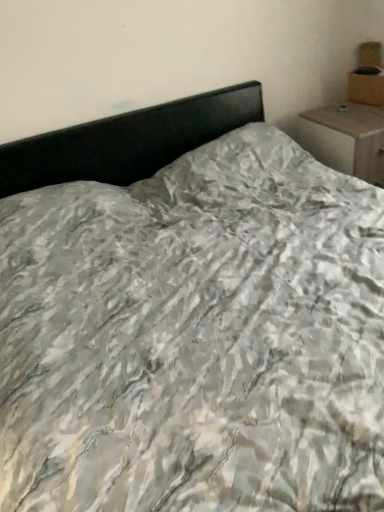
From the picture: Measure the distance between wooden nightstand at upper right and camera.

wooden nightstand at upper right is 6.69 feet away from camera.

You are a GUI agent. You are given a task and a screenshot of the screen. Output one action in this format:
    pyautogui.click(x=<x>, y=<y>)
    Task: Click on the wooden nightstand at upper right
    
    Given the screenshot: What is the action you would take?
    pyautogui.click(x=348, y=138)

The height and width of the screenshot is (512, 384). What do you see at coordinates (348, 138) in the screenshot? I see `wooden nightstand at upper right` at bounding box center [348, 138].

What is the approximate width of cardboard box at upper right?

It is 8.21 inches.

Identify the location of cardboard box at upper right. (366, 86).

Describe the element at coordinates (366, 86) in the screenshot. I see `cardboard box at upper right` at that location.

Where is `wooden nightstand at upper right`? Image resolution: width=384 pixels, height=512 pixels. wooden nightstand at upper right is located at coordinates (348, 138).

Considering the relative positions of cardboard box at upper right and wooden nightstand at upper right in the image provided, is cardboard box at upper right to the left or to the right of wooden nightstand at upper right?

Based on their positions, cardboard box at upper right is located to the right of wooden nightstand at upper right.

Between cardboard box at upper right and wooden nightstand at upper right, which one is positioned in front?

wooden nightstand at upper right is in front.

Is point (370, 70) farther from viewer compared to point (376, 176)?

Yes, point (370, 70) is behind point (376, 176).

From the image's perspective, relative to wooden nightstand at upper right, is cardboard box at upper right above or below?

From the image's perspective, cardboard box at upper right appears above wooden nightstand at upper right.

From a real-world perspective, is cardboard box at upper right positioned above or below wooden nightstand at upper right?

Clearly, from a real-world perspective, cardboard box at upper right is above wooden nightstand at upper right.

Which object is wider, cardboard box at upper right or wooden nightstand at upper right?

wooden nightstand at upper right.

Who is taller, cardboard box at upper right or wooden nightstand at upper right?

wooden nightstand at upper right is taller.

Does cardboard box at upper right have a larger size compared to wooden nightstand at upper right?

Incorrect, cardboard box at upper right is not larger than wooden nightstand at upper right.

Would you say cardboard box at upper right is outside wooden nightstand at upper right?

That's correct, cardboard box at upper right is outside of wooden nightstand at upper right.

Is cardboard box at upper right not near wooden nightstand at upper right?

No, there isn't a large distance between cardboard box at upper right and wooden nightstand at upper right.

Is cardboard box at upper right facing away from wooden nightstand at upper right?

No, cardboard box at upper right is not facing away from wooden nightstand at upper right.

How far apart are cardboard box at upper right and wooden nightstand at upper right?

The distance of cardboard box at upper right from wooden nightstand at upper right is 27.41 centimeters.

Find the location of a particular element. The height and width of the screenshot is (512, 384). nightstand that is on the left side of cardboard box at upper right is located at coordinates (348, 138).

Considering the relative positions of wooden nightstand at upper right and cardboard box at upper right in the image provided, is wooden nightstand at upper right to the left or to the right of cardboard box at upper right?

wooden nightstand at upper right is positioned on cardboard box at upper right's left side.

Based on the photo, is wooden nightstand at upper right further to camera compared to cardboard box at upper right?

No, wooden nightstand at upper right is in front of cardboard box at upper right.

Does point (373, 167) come in front of point (381, 82)?

That is True.

From the image's perspective, who appears lower, wooden nightstand at upper right or cardboard box at upper right?

wooden nightstand at upper right.

From a real-world perspective, between wooden nightstand at upper right and cardboard box at upper right, who is vertically higher?

cardboard box at upper right is physically above.

Which of these two, wooden nightstand at upper right or cardboard box at upper right, is thinner?

cardboard box at upper right.

Who is taller, wooden nightstand at upper right or cardboard box at upper right?

With more height is wooden nightstand at upper right.

Between wooden nightstand at upper right and cardboard box at upper right, which one has smaller size?

cardboard box at upper right is smaller.

Would you say wooden nightstand at upper right contains cardboard box at upper right?

Definitely not — cardboard box at upper right is not inside wooden nightstand at upper right.

Is wooden nightstand at upper right next to cardboard box at upper right and touching it?

They are not placed beside each other.

Could you tell me if wooden nightstand at upper right is facing cardboard box at upper right?

No.

You are a GUI agent. You are given a task and a screenshot of the screen. Output one action in this format:
    pyautogui.click(x=<x>, y=<y>)
    Task: Click on the nightstand below the cardboard box at upper right (from a real-world perspective)
    
    Given the screenshot: What is the action you would take?
    pyautogui.click(x=348, y=138)

This screenshot has width=384, height=512. Identify the location of cardboard box lying on the right of wooden nightstand at upper right. (366, 86).

The width and height of the screenshot is (384, 512). What are the coordinates of `nightstand below the cardboard box at upper right (from a real-world perspective)` in the screenshot? It's located at (348, 138).